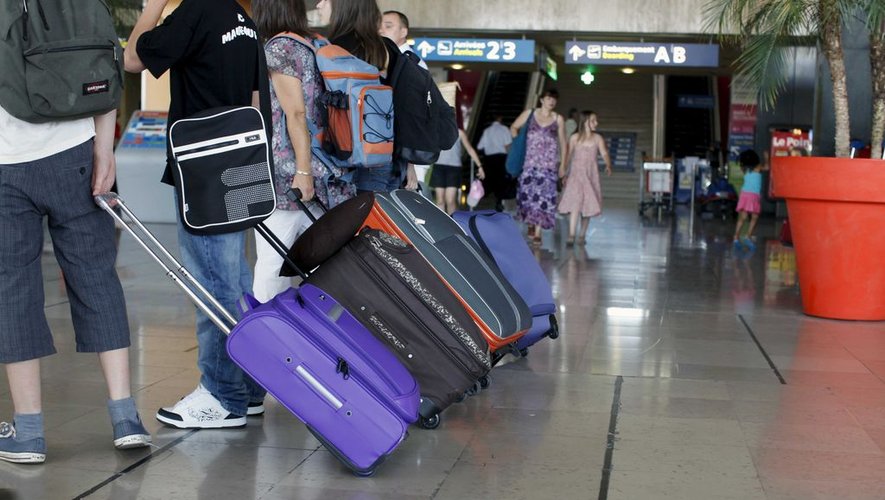
Identify the location of rolling suitcases. (305, 378), (389, 310), (406, 215), (512, 249).